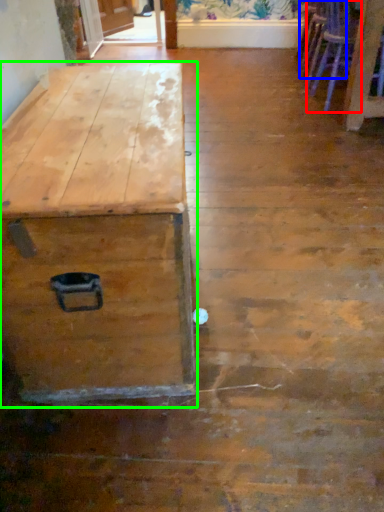
Question: Which object is positioned farthest from armchair (highlighted by a red box)? Select from armchair (highlighted by a blue box) and table (highlighted by a green box).

Choices:
 (A) armchair
 (B) table

Answer: (B)